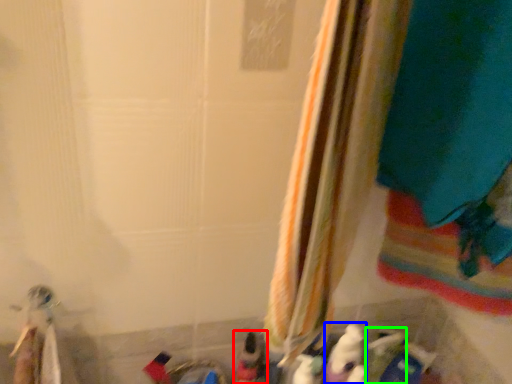
Question: Which object is the farthest from toy (highlighted by a red box)? Choose among these: toy (highlighted by a blue box) or toy (highlighted by a green box).

Choices:
 (A) toy
 (B) toy

Answer: (B)